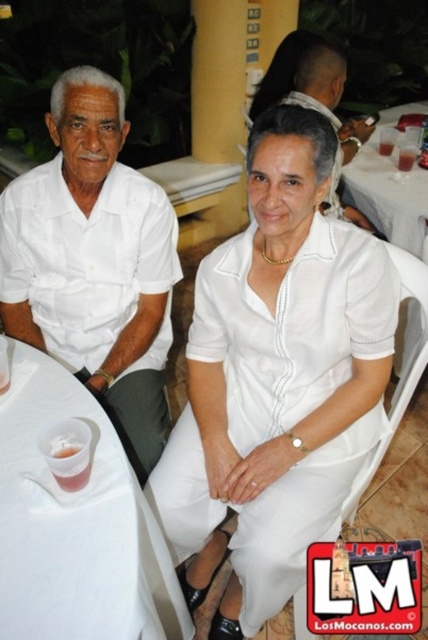
Question: Does clear plastic cup at lower left appear over translucent plastic cup at lower left?

Choices:
 (A) no
 (B) yes

Answer: (A)

Question: Is clear plastic cup at lower left in front of white fabric chair at center?

Choices:
 (A) yes
 (B) no

Answer: (A)

Question: Which point is closer to the camera?

Choices:
 (A) (53, 452)
 (B) (318, 304)

Answer: (A)

Question: From the image, what is the correct spatial relationship of white satin dress at center in relation to white fabric chair at center?

Choices:
 (A) below
 (B) above

Answer: (B)

Question: Which point is farther to the camera?

Choices:
 (A) (398, 387)
 (B) (148, 376)

Answer: (B)

Question: Which object is closer to the camera taking this photo?

Choices:
 (A) translucent plastic cup at lower left
 (B) white fabric chair at center
 (C) white satin dress at center

Answer: (A)